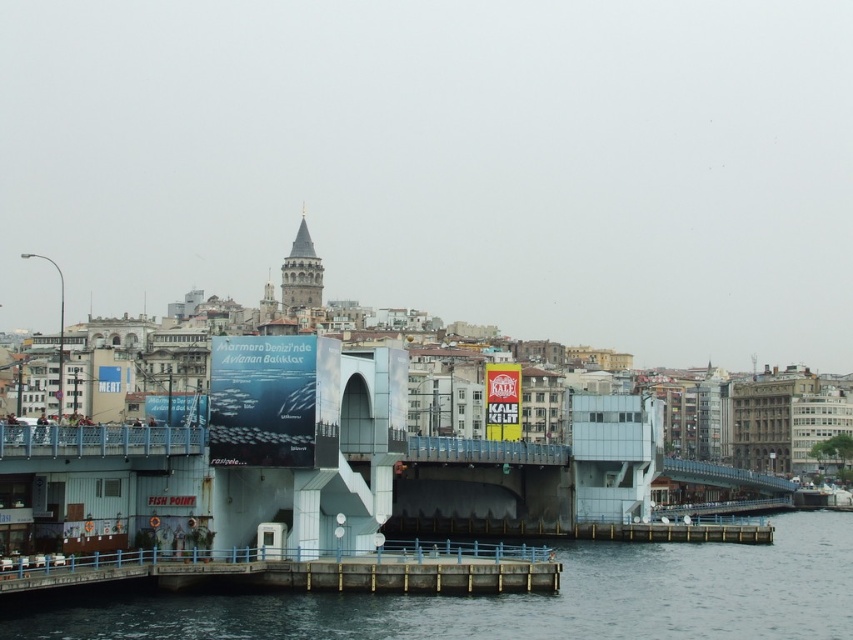
Question: Which of the following is the closest to the observer?

Choices:
 (A) (492, 556)
 (B) (811, 614)

Answer: (B)

Question: Is smooth concrete pier at lower center to the left of smooth concrete dock at lower center from the viewer's perspective?

Choices:
 (A) yes
 (B) no

Answer: (B)

Question: Among these points, which one is farthest from the camera?

Choices:
 (A) (722, 596)
 (B) (440, 572)

Answer: (A)

Question: Can you confirm if smooth concrete pier at lower center is positioned to the right of smooth concrete dock at lower center?

Choices:
 (A) no
 (B) yes

Answer: (B)

Question: Is smooth concrete pier at lower center to the right of smooth concrete dock at lower center from the viewer's perspective?

Choices:
 (A) no
 (B) yes

Answer: (B)

Question: Among these objects, which one is farthest from the camera?

Choices:
 (A) smooth concrete pier at lower center
 (B) smooth concrete dock at lower center

Answer: (B)